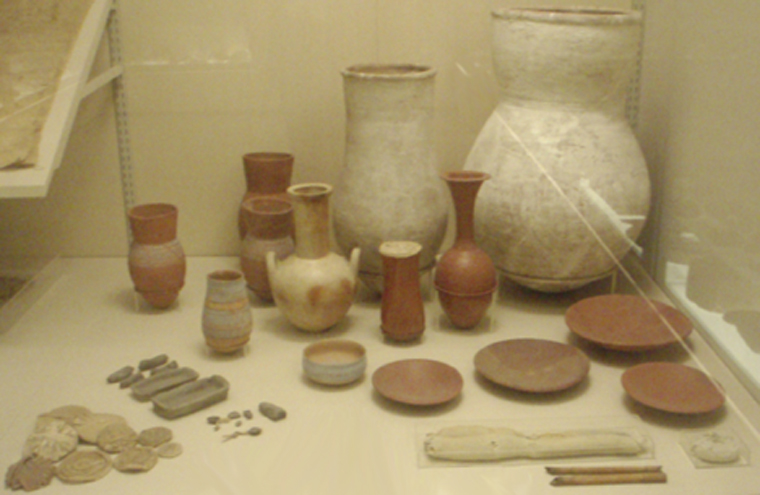
Identify the location of shelf brackets. This screenshot has height=495, width=760. (122, 148), (634, 89).